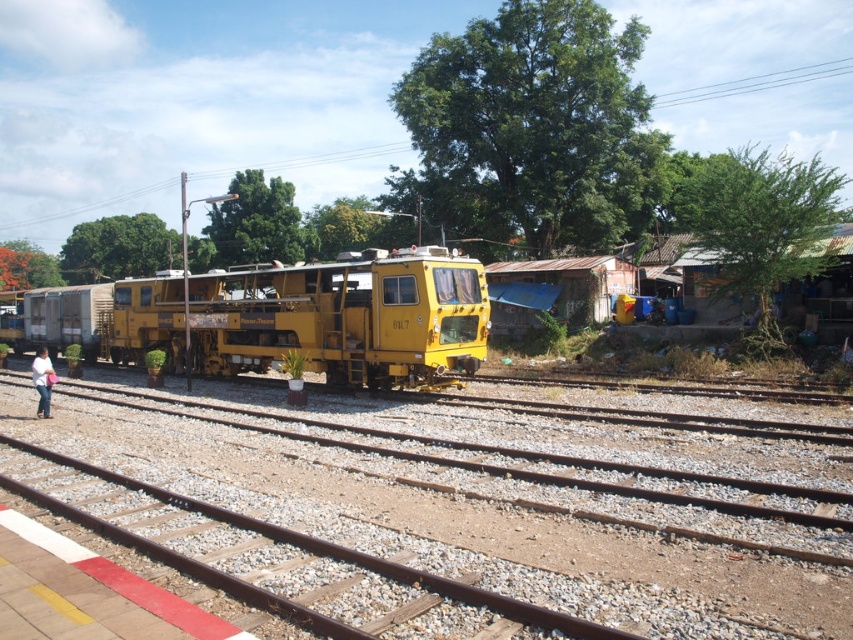
You are a pedestrian standing on the pedestrian walkway with red and white markings. You see the yellow matte train at center and the light blue jeans at lower left. Which object is wider?

The yellow matte train at center is wider than the light blue jeans at lower left according to the description.

You are a railway inspector checking the alignment of the tracks. You notice the brown gravel train track at center and the yellow matte train at center. Which one is narrower in width?

The brown gravel train track at center has a lesser width compared to the yellow matte train at center, so the brown gravel train track at center is narrower.